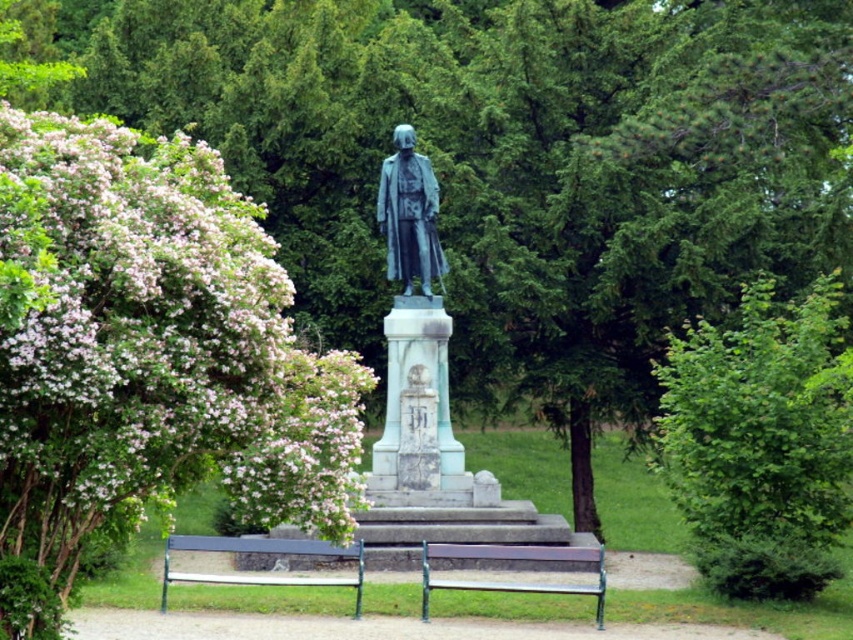
Question: Which point is farther to the camera?

Choices:
 (A) (318, 554)
 (B) (402, 218)
 (C) (138, 195)
 (D) (494, 588)

Answer: (B)

Question: Is metallic green bench at center to the left of wooden bench at center from the viewer's perspective?

Choices:
 (A) yes
 (B) no

Answer: (A)

Question: Which object appears farthest from the camera in this image?

Choices:
 (A) wooden bench at center
 (B) metallic green bench at center
 (C) green leafy bush at upper right
 (D) pink blossoms at left

Answer: (C)

Question: Is bronze statue at center thinner than wooden bench at center?

Choices:
 (A) no
 (B) yes

Answer: (B)

Question: Is green leafy bush at upper right thinner than wooden bench at center?

Choices:
 (A) no
 (B) yes

Answer: (A)

Question: Considering the real-world distances, which object is closest to the green polished stone statue at center?

Choices:
 (A) metallic green bench at center
 (B) bronze statue at center

Answer: (B)